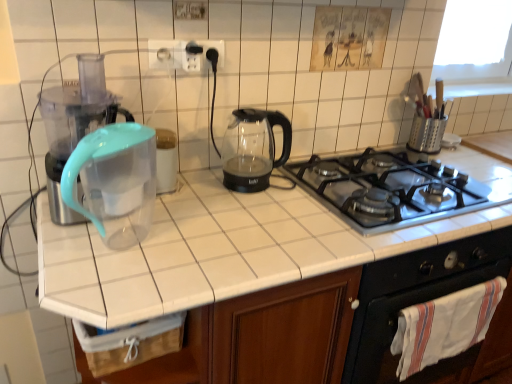
This screenshot has height=384, width=512. What are the coordinates of `vacant space in transparent plastic water filter pitcher at left (from a real-world perspective)` in the screenshot? It's located at (110, 245).